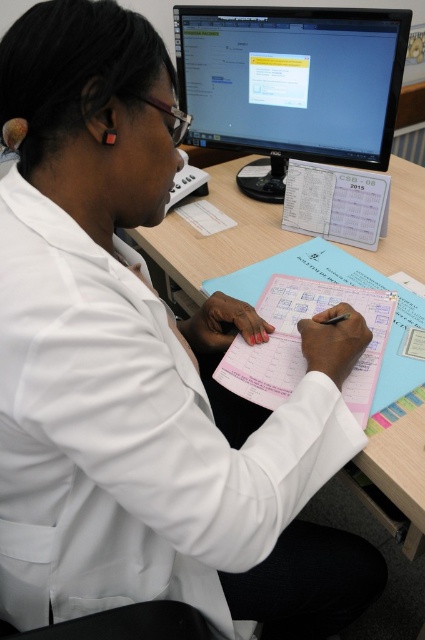
Question: In this image, where is matte black monitor at upper center located relative to pink paper at center?

Choices:
 (A) below
 (B) above

Answer: (B)

Question: Which of these objects is positioned closest to the pink paper at center?

Choices:
 (A) blue paper at center
 (B) matte black monitor at upper center

Answer: (A)

Question: Is blue paper at center further to the viewer compared to pink paper at center?

Choices:
 (A) yes
 (B) no

Answer: (A)

Question: Does blue paper at center appear over pink paper at center?

Choices:
 (A) no
 (B) yes

Answer: (B)

Question: Which object is the closest to the matte black monitor at upper center?

Choices:
 (A) blue paper at center
 (B) pink paper at center

Answer: (A)

Question: Which point is closer to the camera?

Choices:
 (A) pink paper at center
 (B) blue paper at center

Answer: (A)